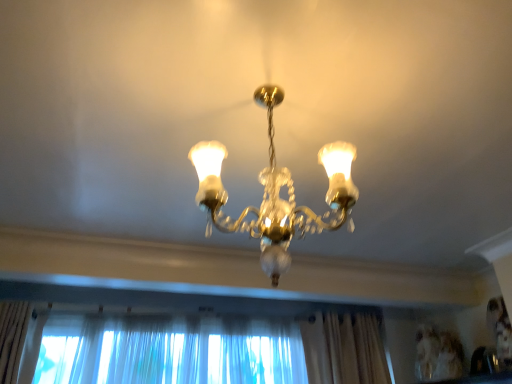
What are the coordinates of `gold crystal chandelier at center` in the screenshot? It's located at (275, 194).

This screenshot has width=512, height=384. What do you see at coordinates (275, 194) in the screenshot?
I see `gold crystal chandelier at center` at bounding box center [275, 194].

Measure the distance between gold crystal chandelier at center and camera.

The depth of gold crystal chandelier at center is 38.56 inches.

Locate an element on the screen. Image resolution: width=512 pixels, height=384 pixels. gold crystal chandelier at center is located at coordinates (275, 194).